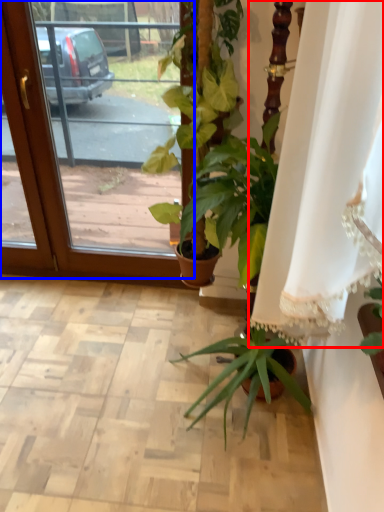
Question: Which object is closer to the camera taking this photo, curtain (highlighted by a red box) or screen door (highlighted by a blue box)?

Choices:
 (A) curtain
 (B) screen door

Answer: (A)